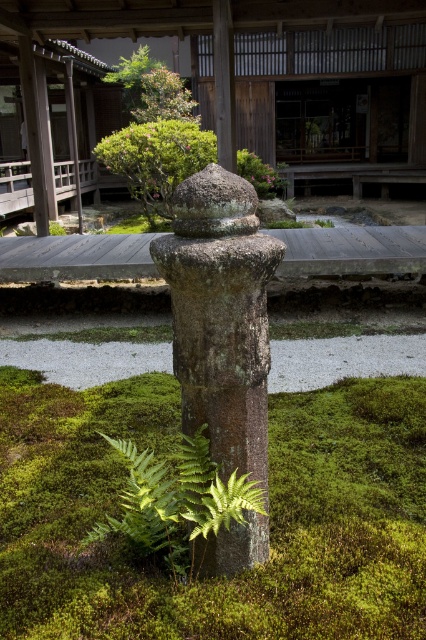
You are standing in the Japanese garden and want to reach the wooden walkway. There is a point at coordinates point (213, 378) that you need to pass through. If your height is 1.7 meters, will you be able to walk through this point without bending down?

The distance of point (213, 378) from viewer is 1.45 meters. Since your height is 1.7 meters, which is taller than the point, you will need to bend down to pass through this point.

You are a gardener planning to trim the plants in the Japanese garden scene. You need to know which plant is wider between the green textured bush at center and the green leafy shrub at upper center. Which one is wider?

The green textured bush at center is wider than the green leafy shrub at upper center according to the description.

You are a gardener tasked with maintaining the Japanese garden. You notice the rusty stone post at center and the green leafy fern at center. Which object has a smaller width?

The rusty stone post at center is thinner than the green leafy fern at center, so the rusty stone post at center has a smaller width.